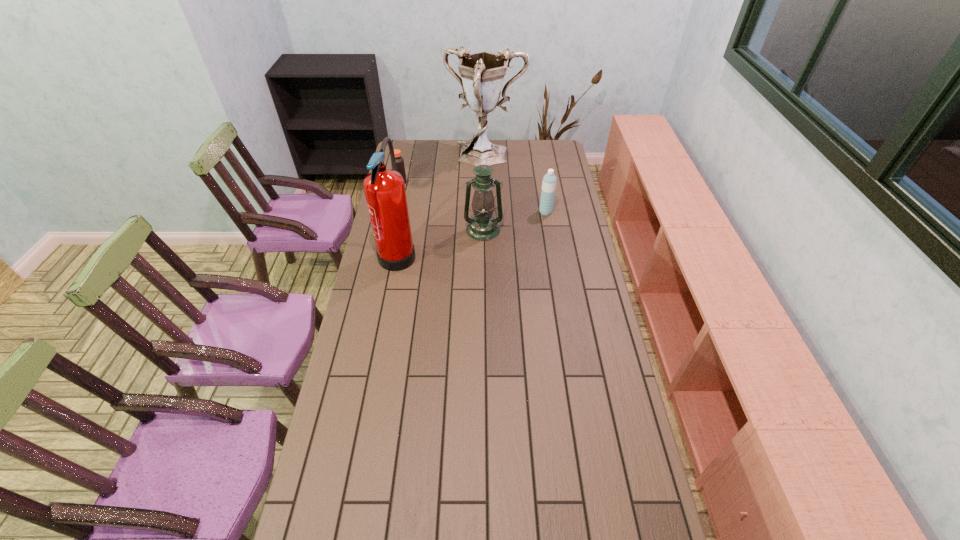
Locate an element on the screen. The height and width of the screenshot is (540, 960). vacant space that's between the third tallest object and the third nearest object is located at coordinates click(515, 221).

The width and height of the screenshot is (960, 540). I want to click on free space between the oil lamp and the fire extinguisher, so click(441, 240).

Locate an element on the screen. The width and height of the screenshot is (960, 540). empty location between the farthest object and the fire extinguisher is located at coordinates (442, 205).

Identify the location of object that is the closest to the fourth nearest object. Image resolution: width=960 pixels, height=540 pixels. (482, 73).

The height and width of the screenshot is (540, 960). Find the location of `the closest object to the fourth nearest object`. the closest object to the fourth nearest object is located at coordinates (482, 73).

This screenshot has width=960, height=540. I want to click on vacant area that satisfies the following two spatial constraints: 1. on the back side of the farthest object; 2. on the left side of the fire extinguisher, so click(x=416, y=158).

Find the location of a particular element. The width and height of the screenshot is (960, 540). free space in the image that satisfies the following two spatial constraints: 1. on the back side of the farthest object; 2. on the left side of the fire extinguisher is located at coordinates tap(416, 158).